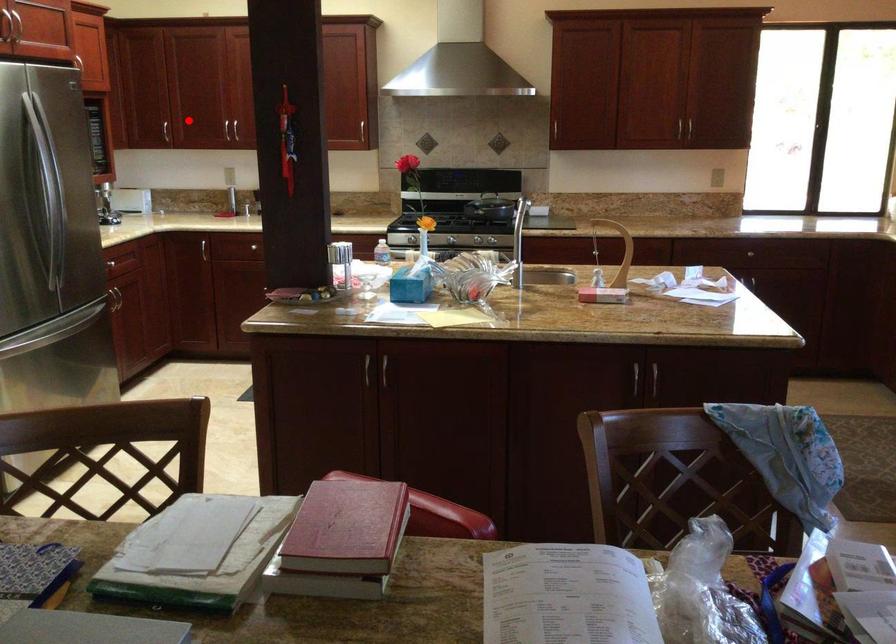
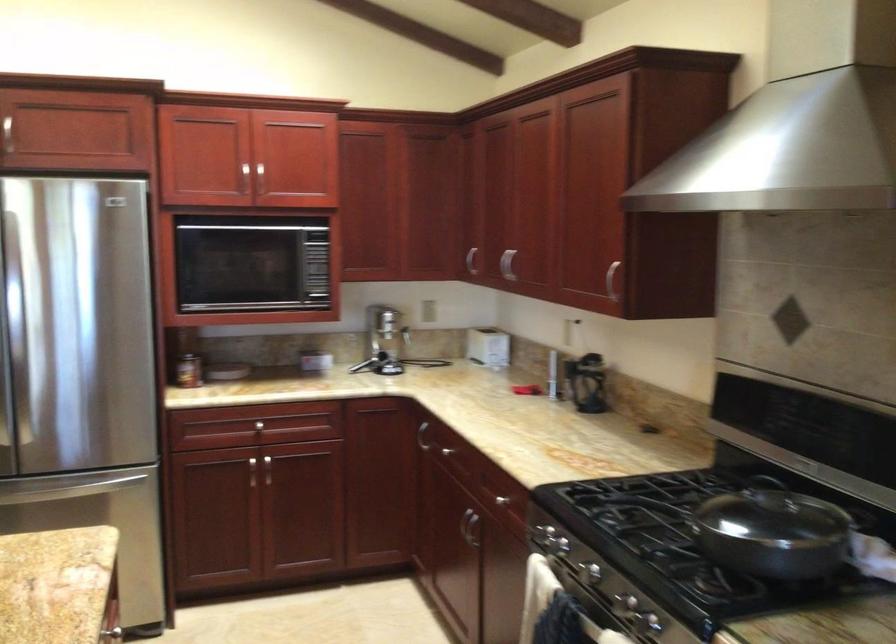
Locate, in the second image, the point that corresponds to the highlighted location in the first image.

(506, 263)